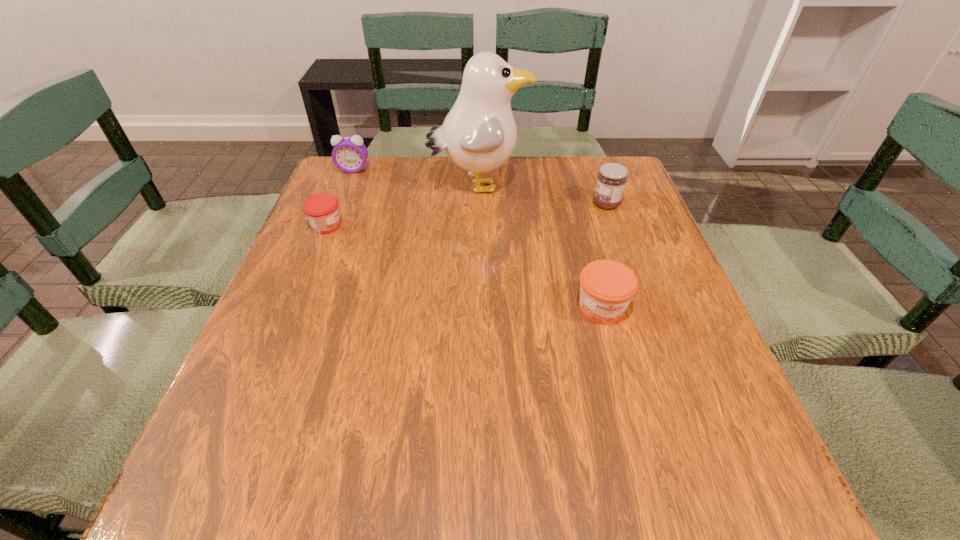
Identify the location of object located in the far right corner section of the desktop. This screenshot has width=960, height=540. (611, 180).

Find the location of `vacant space at the near edge of the desktop`. vacant space at the near edge of the desktop is located at coordinates (626, 515).

You are a GUI agent. You are given a task and a screenshot of the screen. Output one action in this format:
    pyautogui.click(x=<x>, y=<y>)
    Task: Click on the free location at the left edge
    
    Given the screenshot: What is the action you would take?
    pyautogui.click(x=261, y=410)

The width and height of the screenshot is (960, 540). I want to click on vacant space at the right edge, so click(642, 221).

What are the coordinates of `vacant space at the far left corner of the desktop` in the screenshot? It's located at (321, 190).

The height and width of the screenshot is (540, 960). In the image, there is a desktop. Find the location of `free space at the far right corner`. free space at the far right corner is located at coordinates (x=572, y=157).

Locate an element on the screen. This screenshot has height=540, width=960. unoccupied position between the leftmost jam and the nearest object is located at coordinates (464, 267).

At what (x,y) coordinates should I click in order to perform the action: click on unoccupied area between the tallest object and the nearest object. Please return your answer as a coordinate pair (x, y). The width and height of the screenshot is (960, 540). Looking at the image, I should click on (540, 247).

This screenshot has width=960, height=540. I want to click on vacant point located between the alarm clock and the leftmost jam, so click(340, 198).

Locate an element on the screen. vacant space that's between the gull and the shortest jam is located at coordinates (402, 206).